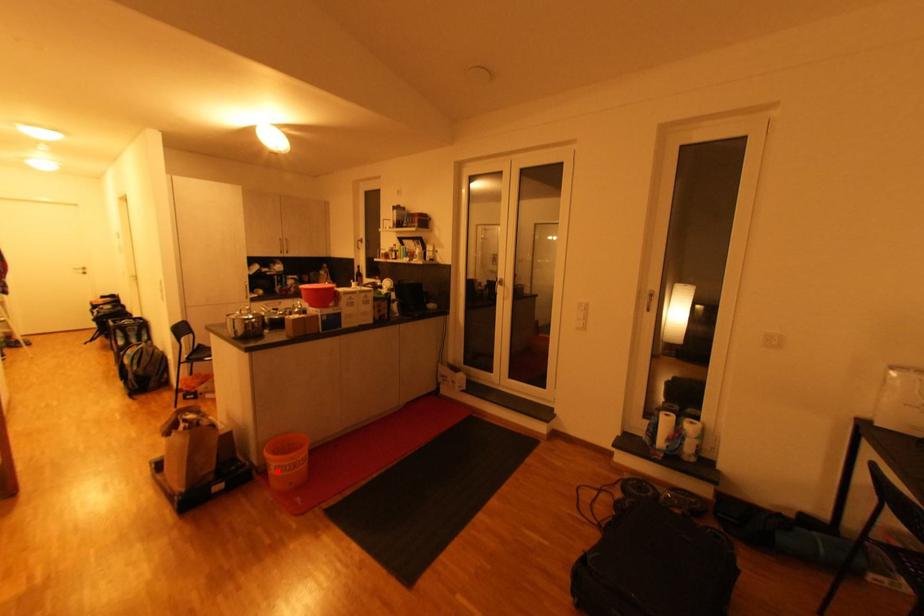
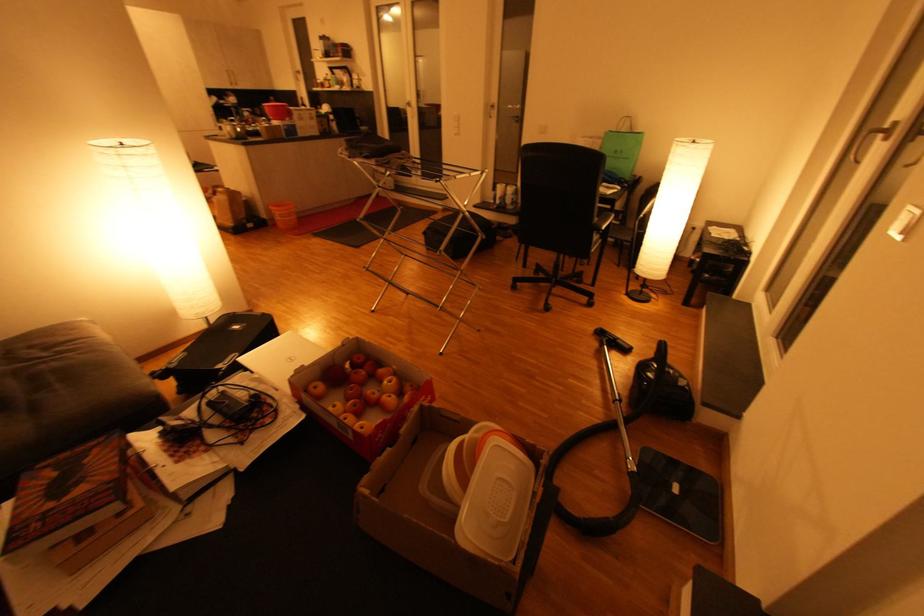
Find the pixel in the second image that matches the highlighted location in the first image.

(282, 219)